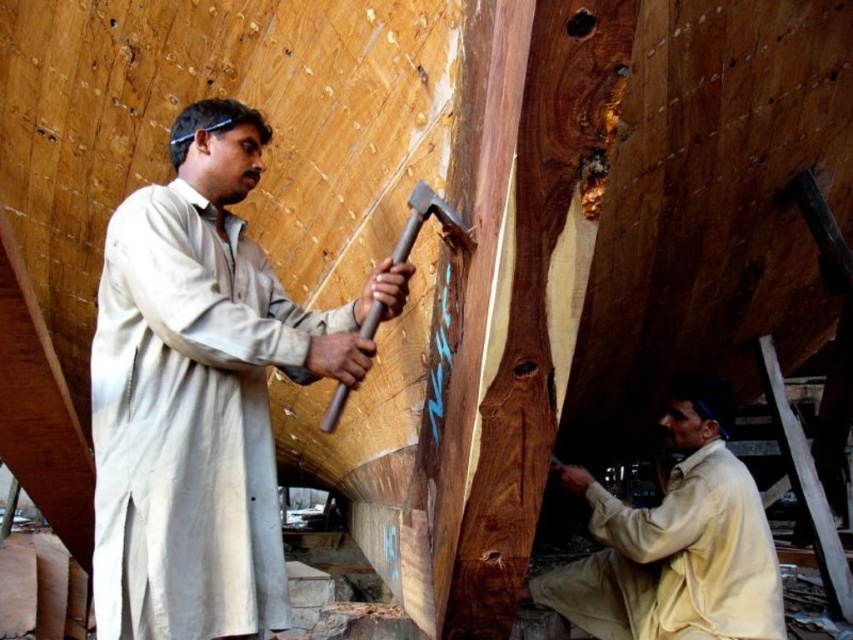
Question: Which is farther from the light beige fabric shirt at left?

Choices:
 (A) light beige fabric at lower right
 (B) wooden handle hammer at center

Answer: (A)

Question: Does light beige fabric shirt at left appear under light beige fabric at lower right?

Choices:
 (A) no
 (B) yes

Answer: (A)

Question: Does light beige fabric shirt at left come behind light beige fabric at lower right?

Choices:
 (A) yes
 (B) no

Answer: (B)

Question: Which point appears farthest from the camera in this image?

Choices:
 (A) (189, 632)
 (B) (735, 579)

Answer: (B)

Question: Which is farther from the light beige fabric shirt at left?

Choices:
 (A) wooden handle hammer at center
 (B) light beige fabric at lower right

Answer: (B)

Question: Can you confirm if light beige fabric shirt at left is positioned to the right of light beige fabric at lower right?

Choices:
 (A) yes
 (B) no

Answer: (B)